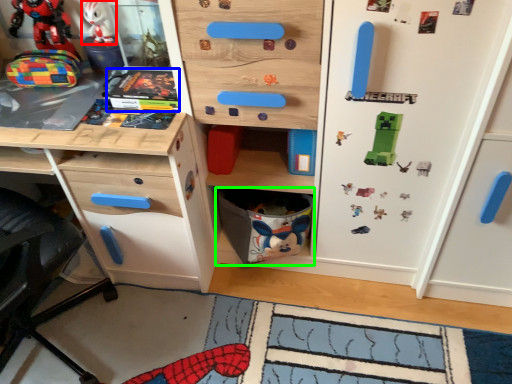
Question: Which is farther away from toy (highlighted by a red box)? comic book (highlighted by a blue box) or cabinet (highlighted by a green box)?

Choices:
 (A) comic book
 (B) cabinet

Answer: (B)